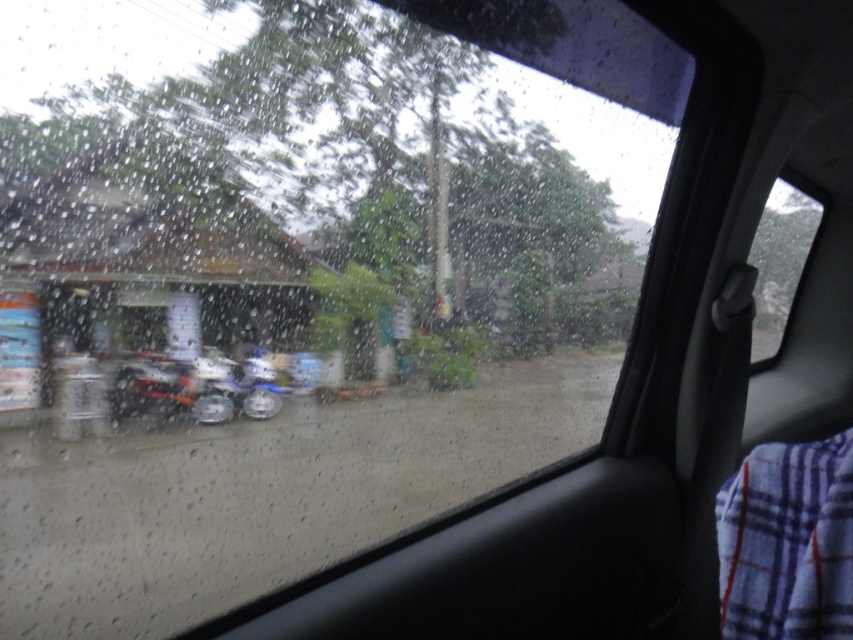
Which of these two, transparent glass window at center or metallic silver motorcycle at center, stands taller?

Standing taller between the two is transparent glass window at center.

Between transparent glass window at center and metallic silver motorcycle at center, which one is positioned higher?

Positioned higher is transparent glass window at center.

Does point (752, 360) come farther from viewer compared to point (128, 365)?

No, (752, 360) is closer to viewer.

The image size is (853, 640). In order to click on transparent glass window at center in this screenshot , I will do `click(781, 259)`.